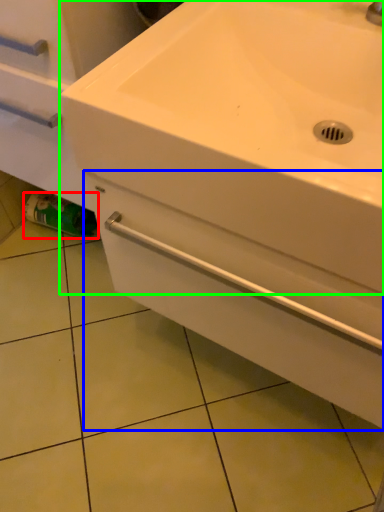
Question: Estimate the real-world distances between objects in this image. Which object is closer to toilet paper (highlighted by a red box), drawer (highlighted by a blue box) or sink (highlighted by a green box)?

Choices:
 (A) drawer
 (B) sink

Answer: (A)